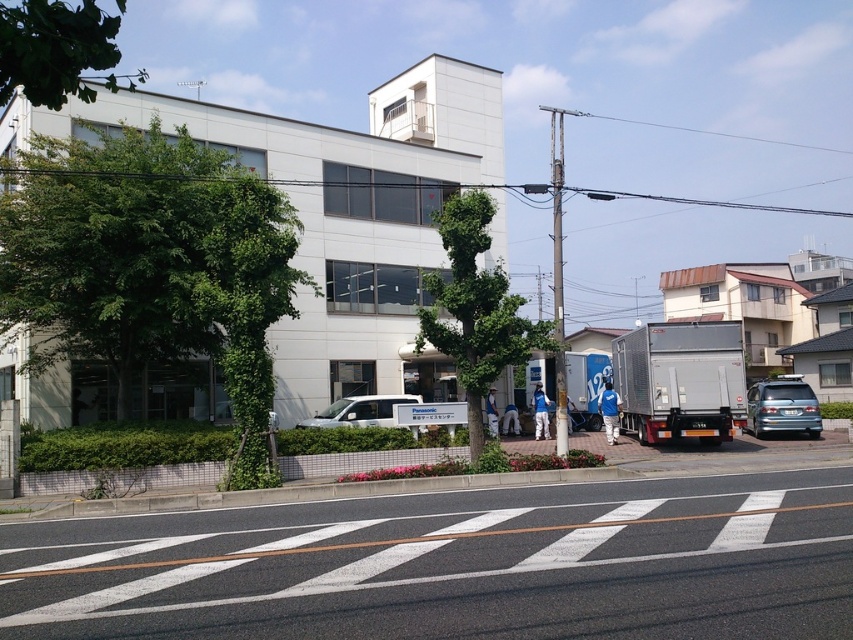
Question: Can you confirm if green leafy tree at left is positioned to the right of green leafy tree at center?

Choices:
 (A) no
 (B) yes

Answer: (A)

Question: Which point is farther to the camera?

Choices:
 (A) (567, 369)
 (B) (778, 422)

Answer: (A)

Question: Can you confirm if green leafy tree at center is wider than green leafy tree at upper left?

Choices:
 (A) yes
 (B) no

Answer: (B)

Question: Can you confirm if green leafy tree at center is positioned above satin blue van at center-right?

Choices:
 (A) no
 (B) yes

Answer: (B)

Question: Based on their relative distances, which object is nearer to the white matte van at center?

Choices:
 (A) green leafy tree at left
 (B) silver metallic truck at right

Answer: (A)

Question: Which is farther from the green leafy tree at left?

Choices:
 (A) blue metallic truck at center
 (B) green leafy tree at center
 (C) white matte van at center
 (D) silver metallic truck at right

Answer: (A)